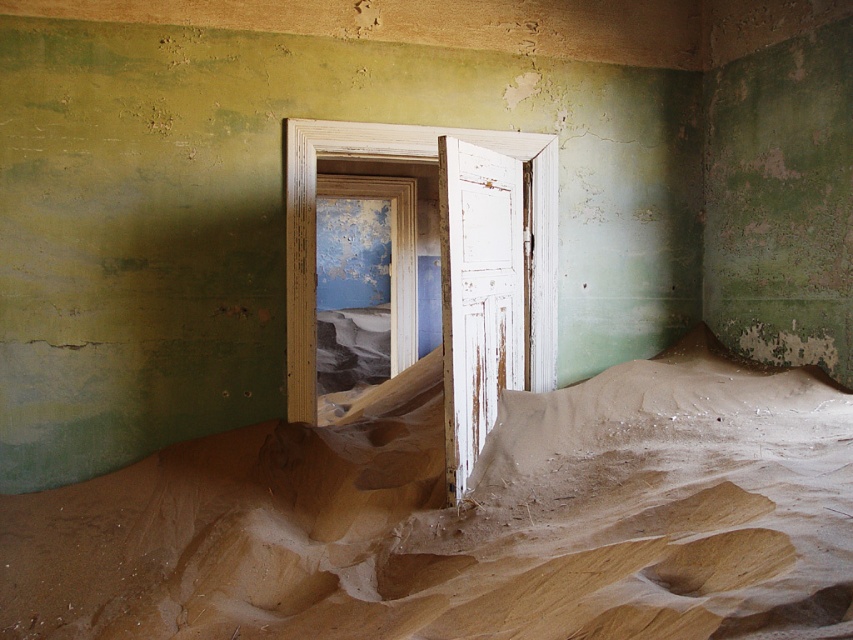
You are a cleaning robot with a width of 24 inches. You are positioned in the room and need to move from the sandy beige blanket at center to the white weathered wood door at center. Can you pass through the space between them without any obstacles?

The distance between the sandy beige blanket at center and the white weathered wood door at center is 32.07 inches. Since the robot is 24 inches wide, it can pass through the space between them as the distance is greater than the robot width.

You are a visitor in this abandoned space. You see the sandy beige blanket at center and the white weathered wood door at center. Which object is positioned to the left of the other?

The sandy beige blanket at center is positioned to the left of the white weathered wood door at center.